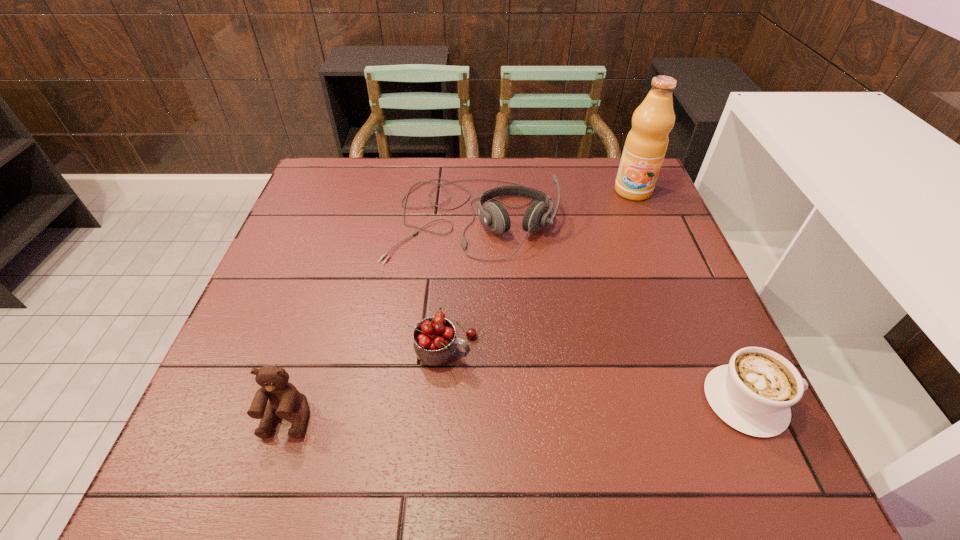
Identify the location of the leftmost object. The width and height of the screenshot is (960, 540). [x=284, y=398].

Locate an element on the screen. the shortest object is located at coordinates (753, 393).

You are a GUI agent. You are given a task and a screenshot of the screen. Output one action in this format:
    pyautogui.click(x=<x>, y=<y>)
    Task: Click on the headset
    
    Given the screenshot: What is the action you would take?
    pyautogui.click(x=494, y=215)

You are a GUI agent. You are given a task and a screenshot of the screen. Output one action in this format:
    pyautogui.click(x=<x>, y=<y>)
    Task: Click on the fruit juice
    Image resolution: width=960 pixels, height=540 pixels.
    Given the screenshot: What is the action you would take?
    pyautogui.click(x=646, y=144)

This screenshot has height=540, width=960. What are the coordinates of `pot filled with cherries` in the screenshot? It's located at (435, 343).

Locate an element on the screen. free location located on the outer surface of the headset is located at coordinates (467, 318).

At what (x,y) coordinates should I click in order to perform the action: click on vacant area located on the outer surface of the headset. Please return your answer as a coordinate pair (x, y). The height and width of the screenshot is (540, 960). Looking at the image, I should click on (464, 375).

This screenshot has width=960, height=540. Identify the location of vacant area situated on the outer surface of the headset. (464, 380).

This screenshot has width=960, height=540. In order to click on vacant space located 0.190m on the front label of the fruit juice in this screenshot , I will do `click(619, 244)`.

In order to click on free space located on the front label of the fruit juice in this screenshot , I will do `click(620, 241)`.